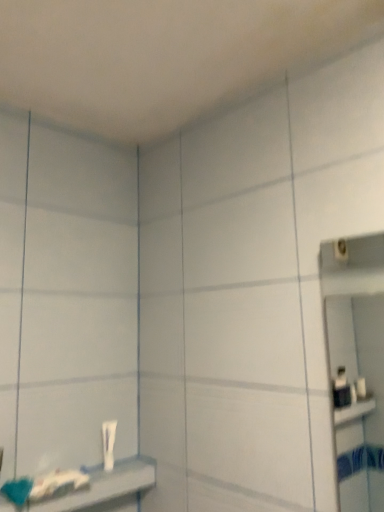
Describe the element at coordinates (108, 443) in the screenshot. I see `white glossy tube at lower left` at that location.

Measure the distance between point (102, 432) and camera.

Point (102, 432) and camera are 4.21 feet apart.

I want to click on white glossy tube at lower left, so click(x=108, y=443).

This screenshot has width=384, height=512. What do you see at coordinates (95, 488) in the screenshot?
I see `white glossy shelf at lower left` at bounding box center [95, 488].

Where is `white glossy shelf at lower left`? This screenshot has width=384, height=512. white glossy shelf at lower left is located at coordinates (95, 488).

Measure the distance between point [144,482] and camera.

A distance of 1.28 meters exists between point [144,482] and camera.

Identify the location of white glossy tube at lower left. Image resolution: width=384 pixels, height=512 pixels. (108, 443).

Is white glossy tube at lower left at the left side of white glossy shelf at lower left?

In fact, white glossy tube at lower left is to the right of white glossy shelf at lower left.

Is white glossy tube at lower left in front of white glossy shelf at lower left?

No, it is not.

Which is nearer, (113, 422) or (79, 501)?

Point (113, 422) is farther from the camera than point (79, 501).

From the image's perspective, which object appears higher, white glossy tube at lower left or white glossy shelf at lower left?

white glossy tube at lower left is shown above in the image.

From a real-world perspective, relative to white glossy shelf at lower left, is white glossy tube at lower left vertically above or below?

white glossy tube at lower left is above white glossy shelf at lower left.

Which of these two, white glossy tube at lower left or white glossy shelf at lower left, is wider?

white glossy shelf at lower left.

Considering the relative sizes of white glossy tube at lower left and white glossy shelf at lower left in the image provided, is white glossy tube at lower left shorter than white glossy shelf at lower left?

In fact, white glossy tube at lower left may be taller than white glossy shelf at lower left.

Looking at this image, considering the relative sizes of white glossy tube at lower left and white glossy shelf at lower left in the image provided, is white glossy tube at lower left bigger than white glossy shelf at lower left?

No.

Can we say white glossy tube at lower left lies outside white glossy shelf at lower left?

Absolutely, white glossy tube at lower left is external to white glossy shelf at lower left.

Is white glossy tube at lower left positioned far away from white glossy shelf at lower left?

No, white glossy tube at lower left is not far away from white glossy shelf at lower left.

Is white glossy tube at lower left facing away from white glossy shelf at lower left?

No, white glossy tube at lower left's orientation is not away from white glossy shelf at lower left.

Where is `shelf that appears on the left of white glossy tube at lower left`? shelf that appears on the left of white glossy tube at lower left is located at coordinates (95, 488).

Between white glossy shelf at lower left and white glossy tube at lower left, which one appears on the left side from the viewer's perspective?

Positioned to the left is white glossy shelf at lower left.

Is the depth of white glossy shelf at lower left less than that of white glossy tube at lower left?

Yes, it is.

Does point (7, 510) come farther from viewer compared to point (110, 456)?

No, (7, 510) is closer to viewer.

From the image's perspective, is white glossy shelf at lower left on white glossy tube at lower left?

Actually, white glossy shelf at lower left appears below white glossy tube at lower left in the image.

From a real-world perspective, who is located higher, white glossy shelf at lower left or white glossy tube at lower left?

white glossy tube at lower left is physically above.

Considering the sizes of objects white glossy shelf at lower left and white glossy tube at lower left in the image provided, who is thinner, white glossy shelf at lower left or white glossy tube at lower left?

With smaller width is white glossy tube at lower left.

Between white glossy shelf at lower left and white glossy tube at lower left, which one has less height?

white glossy shelf at lower left is shorter.

Between white glossy shelf at lower left and white glossy tube at lower left, which one has larger size?

white glossy shelf at lower left.

In the scene shown: Would you say white glossy shelf at lower left contains white glossy tube at lower left?

Actually, white glossy tube at lower left is outside white glossy shelf at lower left.

Is white glossy shelf at lower left far from white glossy tube at lower left?

That's not correct — white glossy shelf at lower left is a little close to white glossy tube at lower left.

Could you tell me if white glossy shelf at lower left is turned towards white glossy tube at lower left?

No, white glossy shelf at lower left is not facing towards white glossy tube at lower left.

How many degrees apart are the facing directions of white glossy shelf at lower left and white glossy tube at lower left?

The angular difference between white glossy shelf at lower left and white glossy tube at lower left is 0.000775 degrees.

Where is `toothpaste to the right of white glossy shelf at lower left`? toothpaste to the right of white glossy shelf at lower left is located at coordinates (108, 443).

Locate an element on the screen. This screenshot has width=384, height=512. shelf located underneath the white glossy tube at lower left (from a real-world perspective) is located at coordinates (95, 488).

This screenshot has width=384, height=512. I want to click on shelf to the left of white glossy tube at lower left, so click(x=95, y=488).